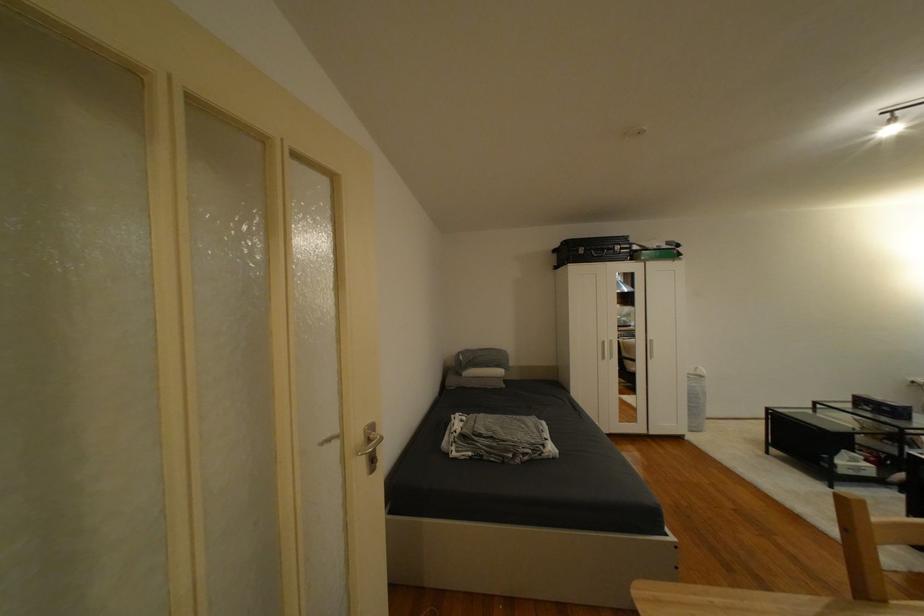
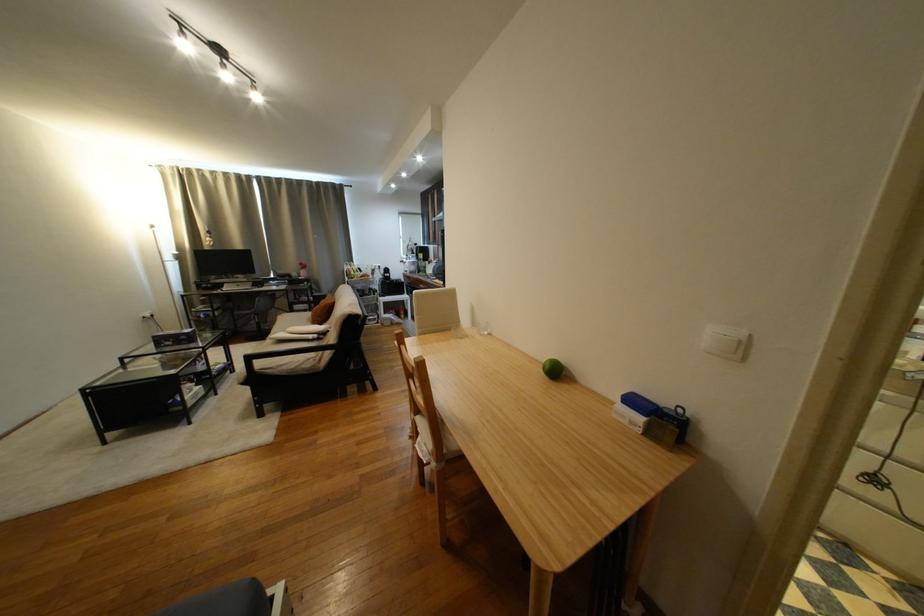
Find the pixel in the second image that matches the point at 681,539 in the first image.

(286, 592)